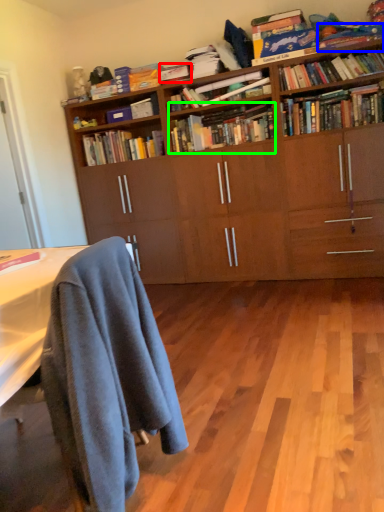
Question: Considering the real-world distances, which object is farthest from book (highlighted by a red box)? book (highlighted by a blue box) or book (highlighted by a green box)?

Choices:
 (A) book
 (B) book

Answer: (A)